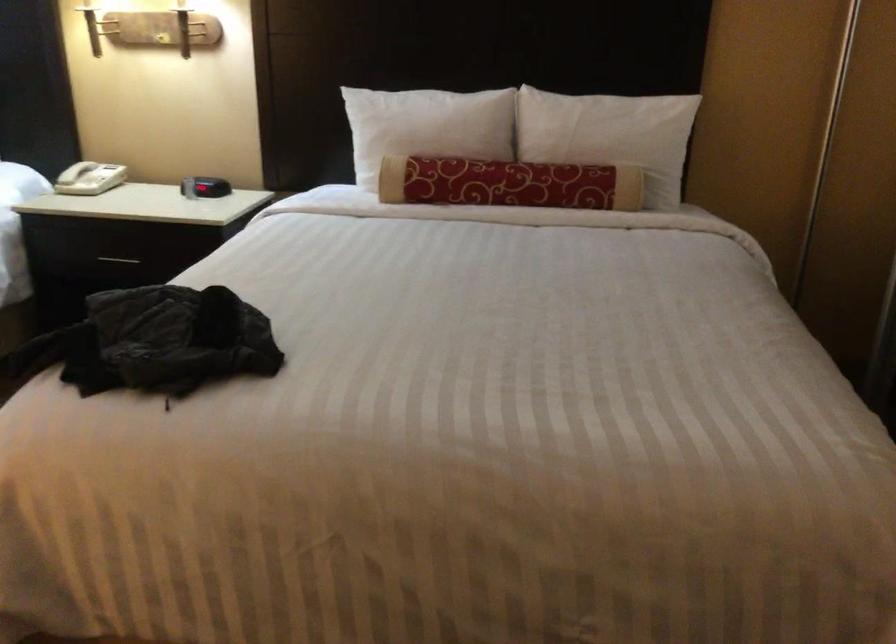
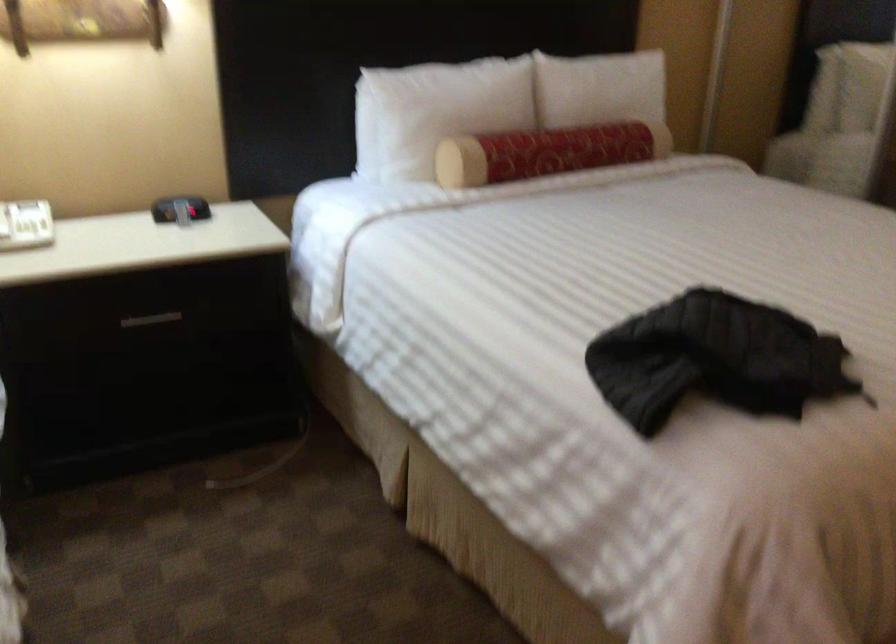
Locate, in the second image, the point that corresponds to pixel 571 129 in the first image.

(599, 88)